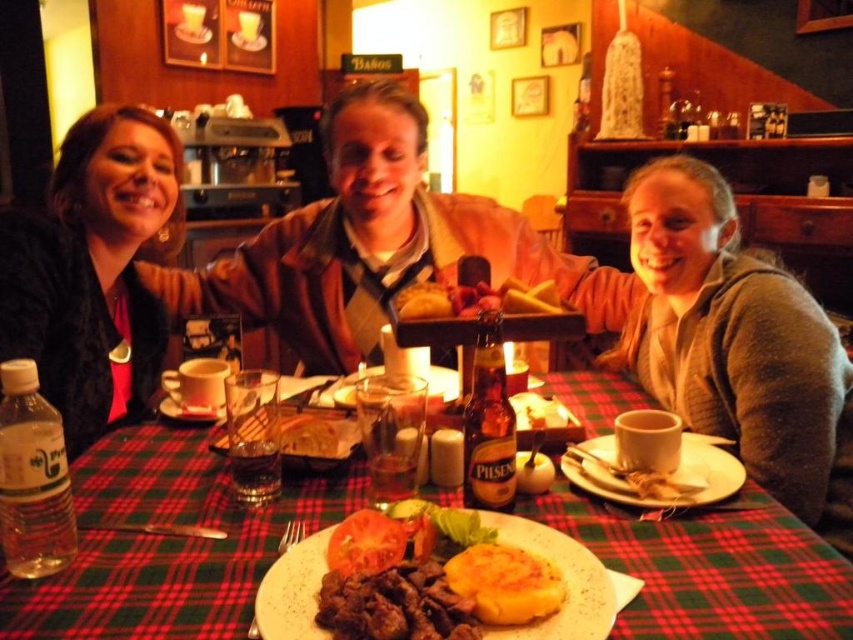
Can you confirm if matte black jacket at left is shorter than golden crispy hash brown at center?

In fact, matte black jacket at left may be taller than golden crispy hash brown at center.

Identify the location of matte black jacket at left. (94, 269).

Identify the location of matte black jacket at left. The width and height of the screenshot is (853, 640). (94, 269).

Where is `matte black jacket at left`? Image resolution: width=853 pixels, height=640 pixels. matte black jacket at left is located at coordinates (94, 269).

Is green plaid tablecloth at center in front of golden crispy hash brown at center?

Yes, it is in front of golden crispy hash brown at center.

What do you see at coordinates (166, 544) in the screenshot? The height and width of the screenshot is (640, 853). I see `green plaid tablecloth at center` at bounding box center [166, 544].

Which is in front, point (100, 515) or point (666, 474)?

Point (100, 515) is in front.

You are a GUI agent. You are given a task and a screenshot of the screen. Output one action in this format:
    pyautogui.click(x=<x>, y=<y>)
    Task: Click on the green plaid tablecloth at center
    
    Given the screenshot: What is the action you would take?
    pyautogui.click(x=166, y=544)

Does matte brown jacket at center appear on the left side of golden crispy bread at center?

Yes, matte brown jacket at center is to the left of golden crispy bread at center.

Locate an element on the screen. The image size is (853, 640). matte brown jacket at center is located at coordinates (376, 244).

Who is more forward, (x=444, y=260) or (x=466, y=589)?

Positioned in front is point (x=466, y=589).

The image size is (853, 640). In order to click on matte brown jacket at center in this screenshot , I will do `click(376, 244)`.